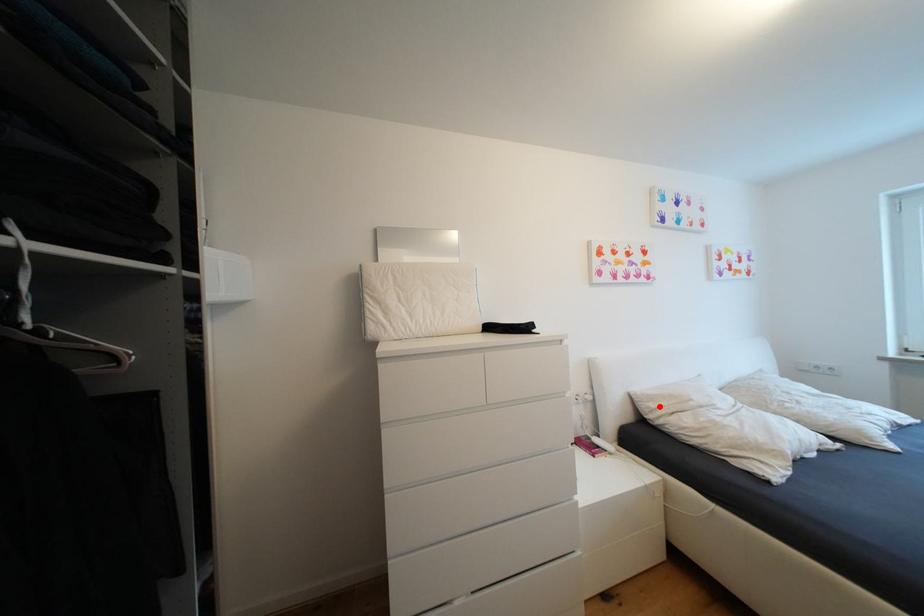
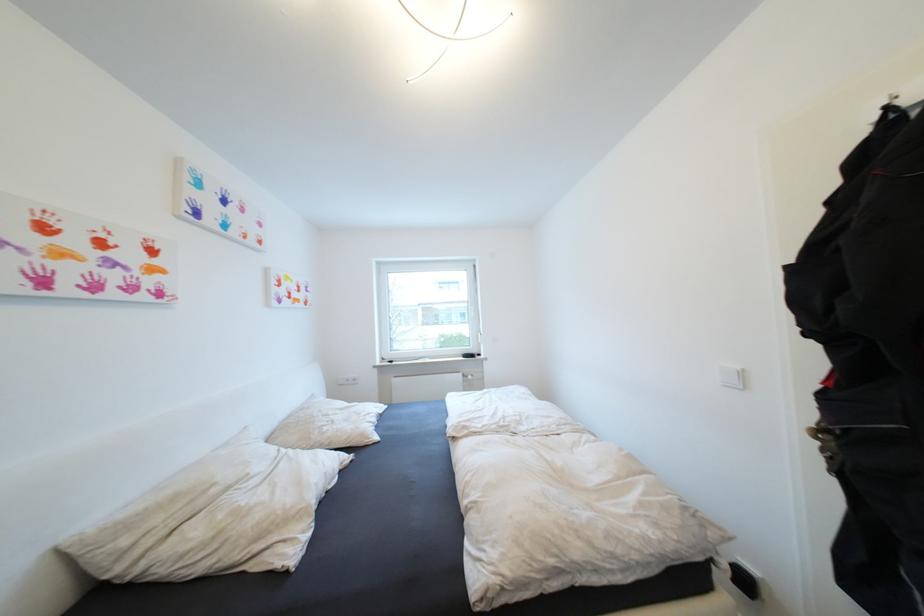
Question: A red point is marked in image1. In image2, is the corresponding 3D point closer to the camera or farther? Reply with the corresponding letter.

Choices:
 (A) The corresponding 3D point is closer.
 (B) The corresponding 3D point is farther.

Answer: (A)